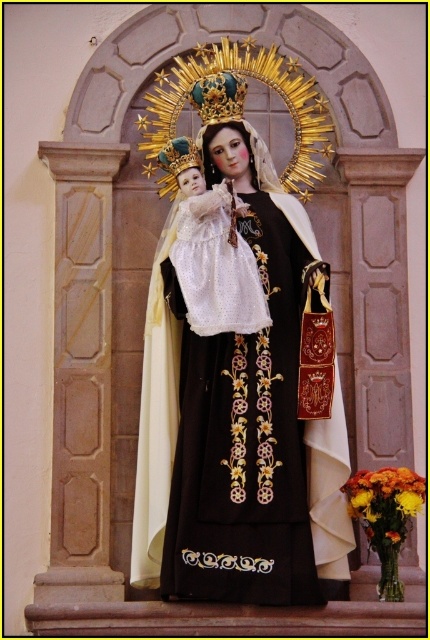
Question: Does black satin dress at center have a smaller size compared to gold metallic crown at upper center?

Choices:
 (A) yes
 (B) no

Answer: (B)

Question: Can you confirm if black satin dress at center is positioned to the left of gold metallic crown at upper center?

Choices:
 (A) no
 (B) yes

Answer: (B)

Question: In this image, where is black satin dress at center located relative to gold metallic crown at upper center?

Choices:
 (A) right
 (B) left

Answer: (B)

Question: Among these objects, which one is nearest to the camera?

Choices:
 (A) gold metallic crown at upper center
 (B) black satin dress at center

Answer: (B)